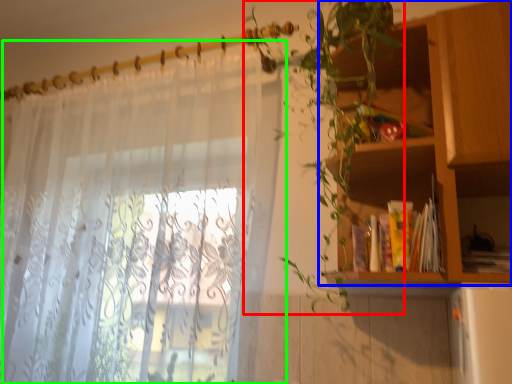
Question: Based on their relative distances, which object is nearer to vegetation (highlighted by a red box)? Choose from shelf (highlighted by a blue box) and curtain (highlighted by a green box).

Choices:
 (A) shelf
 (B) curtain

Answer: (A)